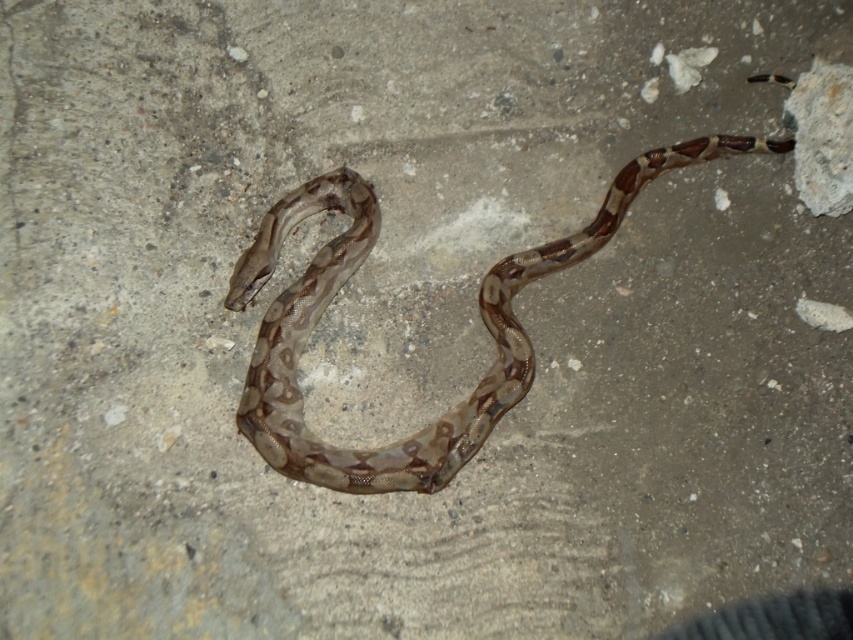
Question: Which point appears farthest from the camera in this image?

Choices:
 (A) (851, 176)
 (B) (265, 458)

Answer: (A)

Question: Which of the following is the closest to the observer?

Choices:
 (A) (845, 124)
 (B) (657, 173)

Answer: (A)

Question: Is the position of brown patterned snake at center less distant than that of speckled concrete rock at upper right?

Choices:
 (A) no
 (B) yes

Answer: (B)

Question: Can you confirm if brown patterned snake at center is bigger than speckled concrete rock at upper right?

Choices:
 (A) no
 (B) yes

Answer: (B)

Question: Which point is farther to the camera?

Choices:
 (A) brown patterned snake at center
 (B) speckled concrete rock at upper right

Answer: (B)

Question: In this image, where is brown patterned snake at center located relative to speckled concrete rock at upper right?

Choices:
 (A) below
 (B) above

Answer: (A)